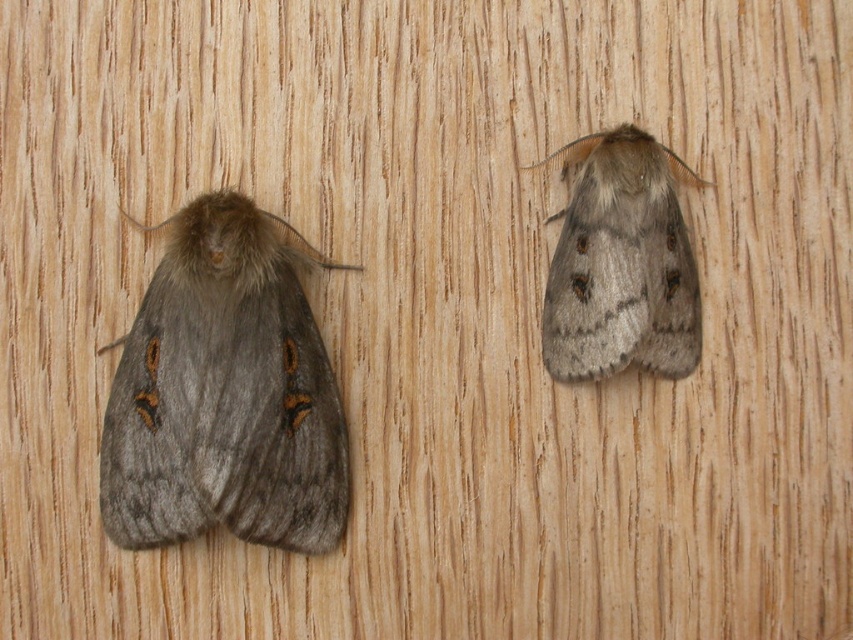
You are looking at the wooden surface with two moths. There are two points marked on the image, point A at coordinates point A is point (126,529) and point B is point (570,273). Which point is closer to you?

Point A at coordinates point A is point (126,529) is closer to the viewer than point B at coordinates point (570,273).